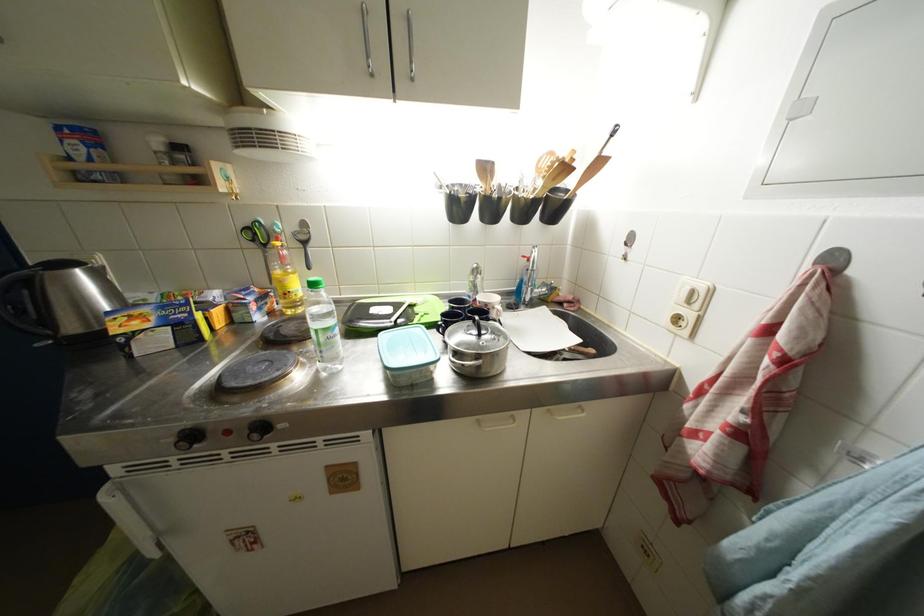
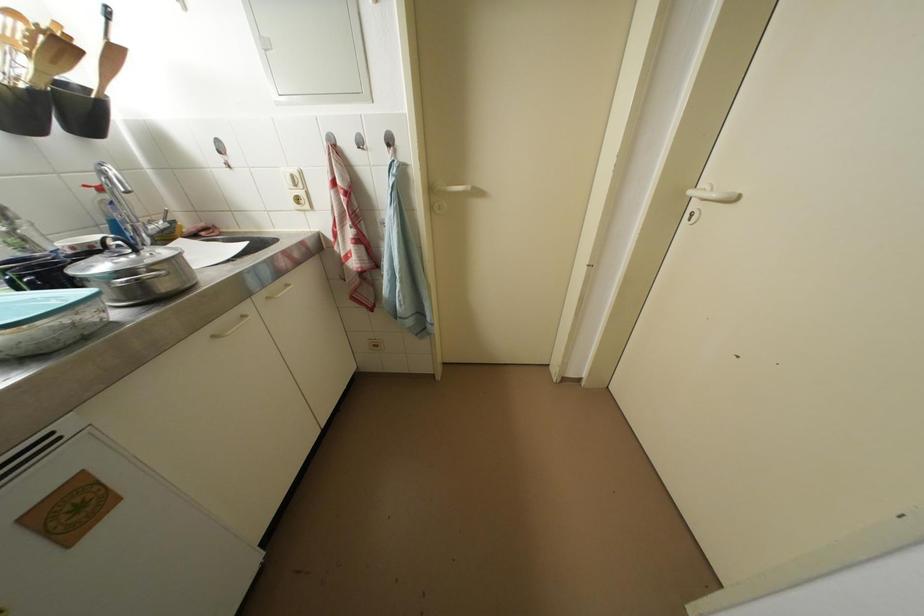
In the second image, find the point that corresponds to the point at 542,294 in the first image.

(157, 231)